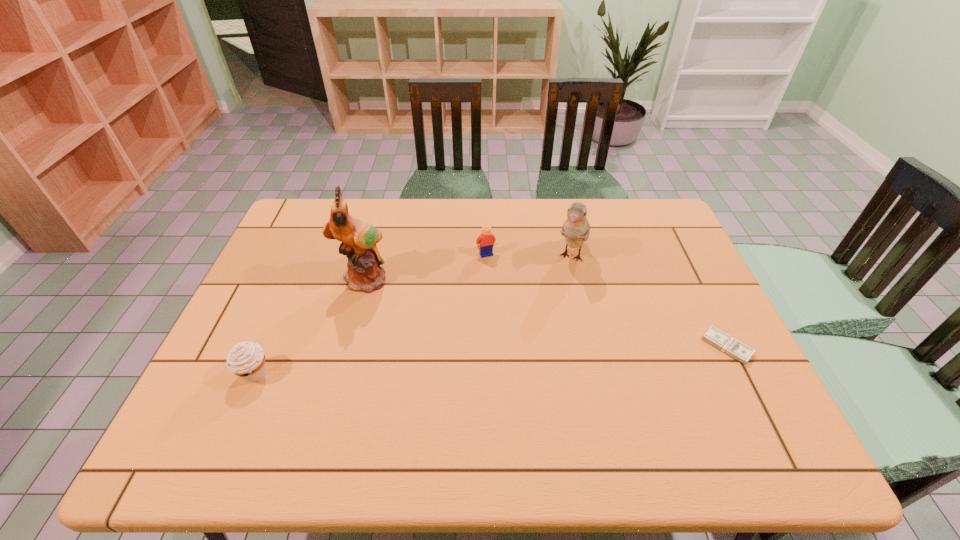
The width and height of the screenshot is (960, 540). In order to click on free spot on the desktop that is between the muffin and the shortest object and is positioned on the front-facing side of the second object from left to right in this screenshot , I will do `click(428, 364)`.

I want to click on free space on the desktop that is between the leftmost object and the shortest object and is positioned at the face of the fourth shortest object, so click(528, 359).

I want to click on vacant spot on the desktop that is between the leftmost object and the shortest object and is positioned on the face of the third object from left to right, so click(x=533, y=358).